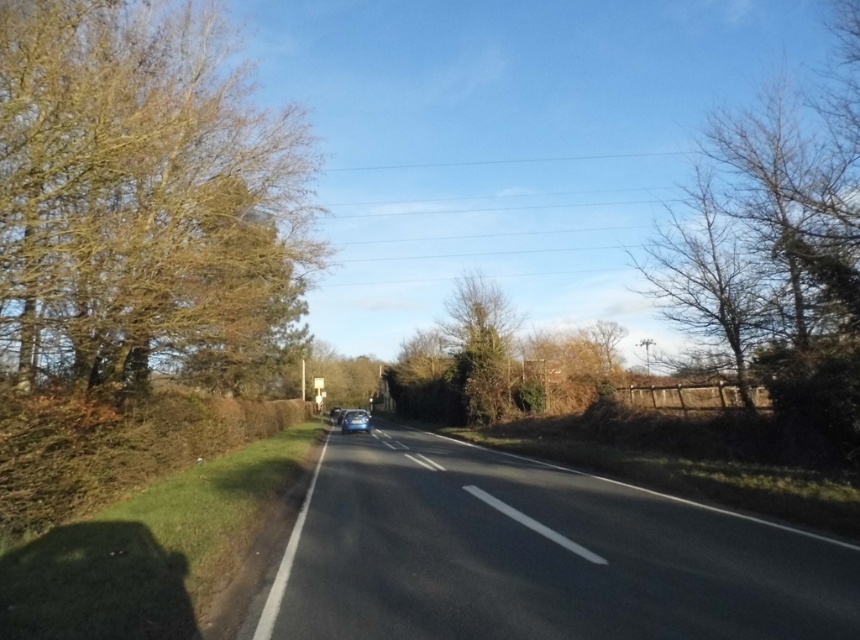
Does black asphalt road at center have a larger size compared to green leafy tree at center?

No, black asphalt road at center is not bigger than green leafy tree at center.

Locate an element on the screen. The height and width of the screenshot is (640, 860). black asphalt road at center is located at coordinates (538, 554).

Measure the distance between point (x=679, y=515) and camera.

9.05 meters

Identify the location of black asphalt road at center. This screenshot has height=640, width=860. (538, 554).

Looking at this image, who is lower down, brown leafy tree at left or green leafy tree at center?

green leafy tree at center

Is point (84, 188) positioned behind point (490, 282)?

No, it is in front of (490, 282).

Locate an element on the screen. brown leafy tree at left is located at coordinates (140, 196).

Can you confirm if black asphalt road at center is thinner than glossy blue car at center?

Incorrect, black asphalt road at center's width is not less than glossy blue car at center's.

Can you confirm if black asphalt road at center is positioned above glossy blue car at center?

Yes, black asphalt road at center is above glossy blue car at center.

Identify the location of black asphalt road at center. (538, 554).

What are the coordinates of `black asphalt road at center` in the screenshot? It's located at (538, 554).